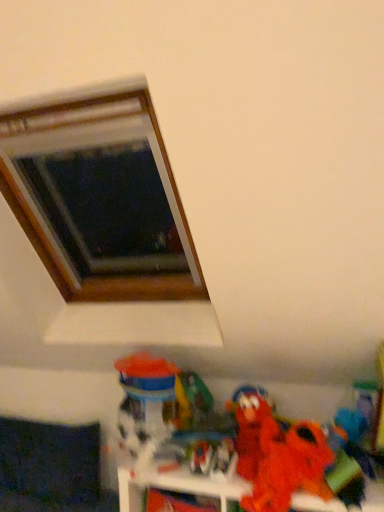
Question: In the image, is matte plastic toy at lower center, the fourth toy positioned from the right, on the left side or the right side of fuzzy red plush at lower right, arranged as the fifth toy when viewed from the left?

Choices:
 (A) left
 (B) right

Answer: (A)

Question: Looking at the image, does matte plastic toy at lower center, the fourth toy positioned from the right, seem bigger or smaller compared to fuzzy red plush at lower right, which is the first toy from right to left?

Choices:
 (A) big
 (B) small

Answer: (B)

Question: Which of these objects is positioned farthest from the fuzzy fabric plush at lower right?

Choices:
 (A) fuzzy red plush at lower right, arranged as the fifth toy when viewed from the left
 (B) translucent plastic toy at lower center, which ranks as the first toy in left-to-right order
 (C) matte plastic toy at lower center, positioned as the 2th toy in left-to-right order
 (D) dark fabric couch at lower left
 (E) wooden frame at upper left

Answer: (E)

Question: Based on their relative distances, which object is nearer to the matte plastic toy at lower center, the fourth toy positioned from the right?

Choices:
 (A) dark fabric couch at lower left
 (B) translucent plastic toy at lower center, which ranks as the first toy in left-to-right order
 (C) fuzzy fabric plush at lower right
 (D) matte plastic toy at lower center, the 3th toy in the left-to-right sequence
 (E) fuzzy red plush at lower right, which is the first toy from right to left

Answer: (D)